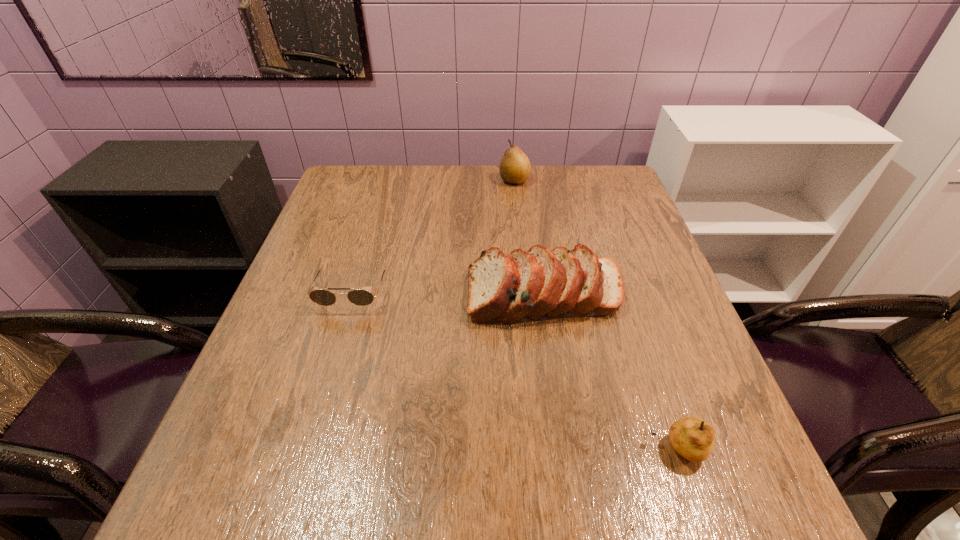
You are a GUI agent. You are given a task and a screenshot of the screen. Output one action in this format:
    pyautogui.click(x=<x>, y=<y>)
    Task: Click on the left pear
    This screenshot has width=960, height=540.
    Given the screenshot: What is the action you would take?
    pyautogui.click(x=514, y=168)

You are a GUI agent. You are given a task and a screenshot of the screen. Output one action in this format:
    pyautogui.click(x=<x>, y=<y>)
    Task: Click on the taller pear
    This screenshot has height=540, width=960.
    Given the screenshot: What is the action you would take?
    pyautogui.click(x=514, y=168)

You are a GUI agent. You are given a task and a screenshot of the screen. Output one action in this format:
    pyautogui.click(x=<x>, y=<y>)
    Task: Click on the bread
    
    Given the screenshot: What is the action you would take?
    pyautogui.click(x=541, y=284)

Locate an element on the screen. The height and width of the screenshot is (540, 960). the right pear is located at coordinates (691, 437).

Identify the location of the nearest object. This screenshot has height=540, width=960. (691, 437).

You are a GUI agent. You are given a task and a screenshot of the screen. Output one action in this format:
    pyautogui.click(x=<x>, y=<y>)
    Task: Click on the sunglasses
    The width and height of the screenshot is (960, 540).
    Given the screenshot: What is the action you would take?
    pyautogui.click(x=359, y=297)

Image resolution: width=960 pixels, height=540 pixels. Identify the location of the leftmost object. (359, 297).

The width and height of the screenshot is (960, 540). Identify the location of free space located on the right of the taller pear. (591, 180).

Locate an element on the screen. The height and width of the screenshot is (540, 960). free region located 0.160m on the back of the bread is located at coordinates (535, 226).

This screenshot has height=540, width=960. What are the coordinates of `free space located 0.090m on the back of the third tallest object` in the screenshot? It's located at (656, 384).